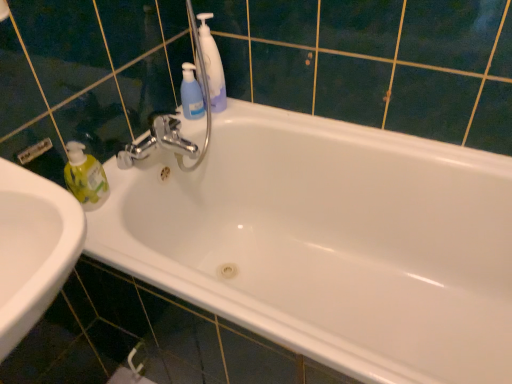
What do you see at coordinates (191, 94) in the screenshot? The image size is (512, 384). I see `blue translucent bottle at upper center` at bounding box center [191, 94].

What do you see at coordinates (212, 65) in the screenshot? The height and width of the screenshot is (384, 512). I see `translucent blue pump bottle at upper center` at bounding box center [212, 65].

I want to click on blue translucent bottle at upper center, so click(191, 94).

Is white glossy bathtub at center next to blue translucent bottle at upper center?

No, white glossy bathtub at center is not touching blue translucent bottle at upper center.

In the image, is white glossy bathtub at center positioned in front of or behind blue translucent bottle at upper center?

Clearly, white glossy bathtub at center is in front of blue translucent bottle at upper center.

How many degrees apart are the facing directions of white glossy bathtub at center and blue translucent bottle at upper center?

white glossy bathtub at center and blue translucent bottle at upper center are facing 92.4 degrees away from each other.

In terms of width, does white glossy bathtub at center look wider or thinner when compared to blue translucent bottle at upper center?

white glossy bathtub at center is wider than blue translucent bottle at upper center.

From their relative heights in the image, would you say blue translucent bottle at upper center is taller or shorter than translucent blue pump bottle at upper center?

Considering their sizes, blue translucent bottle at upper center has less height than translucent blue pump bottle at upper center.

Does blue translucent bottle at upper center appear on the right side of translucent blue pump bottle at upper center?

No.

From the image's perspective, which one is positioned higher, blue translucent bottle at upper center or translucent blue pump bottle at upper center?

translucent blue pump bottle at upper center appears higher in the image.

Does point (201, 91) appear closer or farther from the camera than point (207, 64)?

Point (201, 91) is positioned farther from the camera compared to point (207, 64).

Is white glossy bathtub at center completely or partially inside blue translucent bottle at upper center?

No, white glossy bathtub at center is not surrounded by blue translucent bottle at upper center.

How distant is blue translucent bottle at upper center from white glossy bathtub at center?

blue translucent bottle at upper center is 20.18 inches away from white glossy bathtub at center.

Identify the location of bathtub in front of the blue translucent bottle at upper center. (329, 243).

Based on the photo, can you tell me how much blue translucent bottle at upper center and white glossy bathtub at center differ in facing direction?

There is a 92.4-degree angle between the facing directions of blue translucent bottle at upper center and white glossy bathtub at center.

Considering the sizes of objects white glossy bathtub at center and translucent blue pump bottle at upper center in the image provided, who is wider, white glossy bathtub at center or translucent blue pump bottle at upper center?

Wider between the two is white glossy bathtub at center.

Between white glossy bathtub at center and translucent blue pump bottle at upper center, which one has more height?

With more height is white glossy bathtub at center.

How many degrees apart are the facing directions of white glossy bathtub at center and translucent blue pump bottle at upper center?

white glossy bathtub at center and translucent blue pump bottle at upper center are facing 92.4 degrees away from each other.

Considering the positions of objects translucent blue pump bottle at upper center and blue translucent bottle at upper center in the image provided, who is behind, translucent blue pump bottle at upper center or blue translucent bottle at upper center?

Positioned behind is blue translucent bottle at upper center.

Can you confirm if translucent blue pump bottle at upper center is taller than blue translucent bottle at upper center?

Indeed, translucent blue pump bottle at upper center has a greater height compared to blue translucent bottle at upper center.

Does point (205, 30) appear closer or farther from the camera than point (194, 113)?

Point (205, 30) is closer to the camera than point (194, 113).

Considering the sizes of objects translucent blue pump bottle at upper center and blue translucent bottle at upper center in the image provided, who is smaller, translucent blue pump bottle at upper center or blue translucent bottle at upper center?

blue translucent bottle at upper center is smaller.

From the image's perspective, which one is positioned higher, translucent blue pump bottle at upper center or white glossy bathtub at center?

translucent blue pump bottle at upper center appears higher in the image.

Between translucent blue pump bottle at upper center and white glossy bathtub at center, which one has smaller width?

With smaller width is translucent blue pump bottle at upper center.

Is point (225, 94) positioned after point (345, 198)?

Yes, it is behind point (345, 198).

You are a GUI agent. You are given a task and a screenshot of the screen. Output one action in this format:
    pyautogui.click(x=<x>, y=<y>)
    Task: Click on the bathtub that appears below the blue translucent bottle at upper center (from the image's perspective)
    The image size is (512, 384).
    Given the screenshot: What is the action you would take?
    pyautogui.click(x=329, y=243)

What are the coordinates of `cleaning product lying on the right of blue translucent bottle at upper center` in the screenshot? It's located at (212, 65).

Based on their spatial positions, is white glossy bathtub at center or blue translucent bottle at upper center closer to translucent blue pump bottle at upper center?

blue translucent bottle at upper center is closer to translucent blue pump bottle at upper center.

From the picture: Based on their spatial positions, is translucent blue pump bottle at upper center or blue translucent bottle at upper center closer to white glossy bathtub at center?

translucent blue pump bottle at upper center is positioned closer to the anchor white glossy bathtub at center.

Considering their positions, is blue translucent bottle at upper center positioned closer to translucent blue pump bottle at upper center than white glossy bathtub at center?

blue translucent bottle at upper center is positioned closer to the anchor translucent blue pump bottle at upper center.

Estimate the real-world distances between objects in this image. Which object is further from blue translucent bottle at upper center, translucent blue pump bottle at upper center or white glossy bathtub at center?

Based on the image, white glossy bathtub at center appears to be further to blue translucent bottle at upper center.

Looking at the image, which one is located further to white glossy bathtub at center, blue translucent bottle at upper center or translucent blue pump bottle at upper center?

The object further to white glossy bathtub at center is blue translucent bottle at upper center.

Looking at the image, which one is located further to blue translucent bottle at upper center, white glossy bathtub at center or translucent blue pump bottle at upper center?

Among the two, white glossy bathtub at center is located further to blue translucent bottle at upper center.

The image size is (512, 384). Identify the location of cleaning product between white glossy bathtub at center and blue translucent bottle at upper center from front to back. (212, 65).